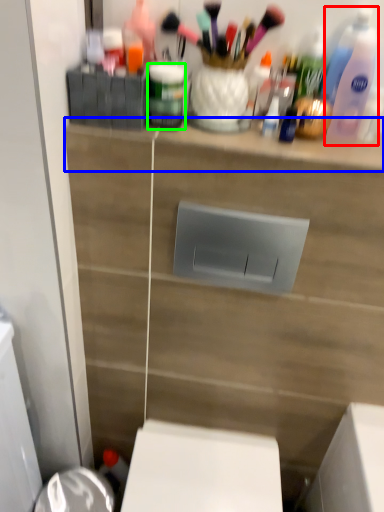
Question: Which is nearer to the cleaning product (highlighted by a red box)? ledge (highlighted by a blue box) or toiletry (highlighted by a green box).

Choices:
 (A) ledge
 (B) toiletry

Answer: (A)